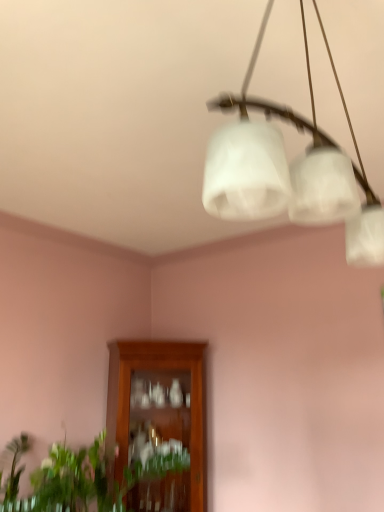
Question: Is point (251, 207) closer or farther from the camera than point (84, 452)?

Choices:
 (A) farther
 (B) closer

Answer: (B)

Question: Looking at their shapes, would you say white frosted glass chandelier at upper center is wider or thinner than green leafy plant at lower left?

Choices:
 (A) thin
 (B) wide

Answer: (A)

Question: Which object is positioned closest to the white frosted glass chandelier at upper center?

Choices:
 (A) green leafy plant at lower left
 (B) wooden cabinet at center

Answer: (A)

Question: Estimate the real-world distances between objects in this image. Which object is closer to the green leafy plant at lower left?

Choices:
 (A) wooden cabinet at center
 (B) white frosted glass chandelier at upper center

Answer: (A)